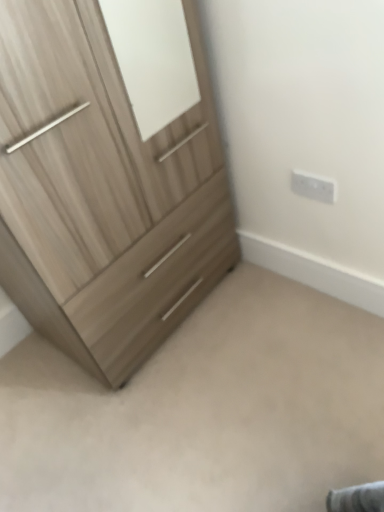
At what (x,y) coordinates should I click in order to perform the action: click on free space above light wood dresser at lower left (from a real-world perspective). Please return your answer as a coordinate pair (x, y). The height and width of the screenshot is (512, 384). Looking at the image, I should click on (222, 409).